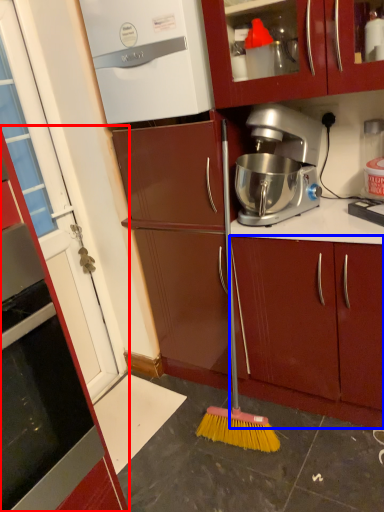
Question: Which point is further to the camera, cabinetry (highlighted by a red box) or cabinetry (highlighted by a blue box)?

Choices:
 (A) cabinetry
 (B) cabinetry

Answer: (B)